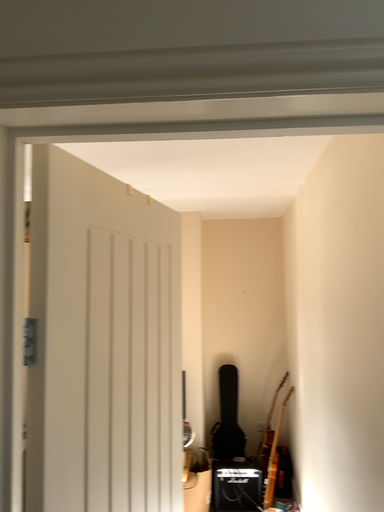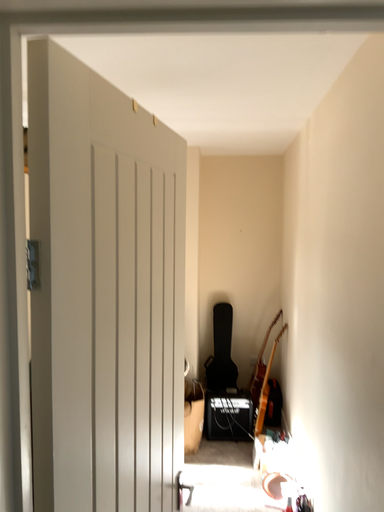
Question: Which way did the camera rotate in the video?

Choices:
 (A) rotated upward
 (B) rotated downward

Answer: (B)